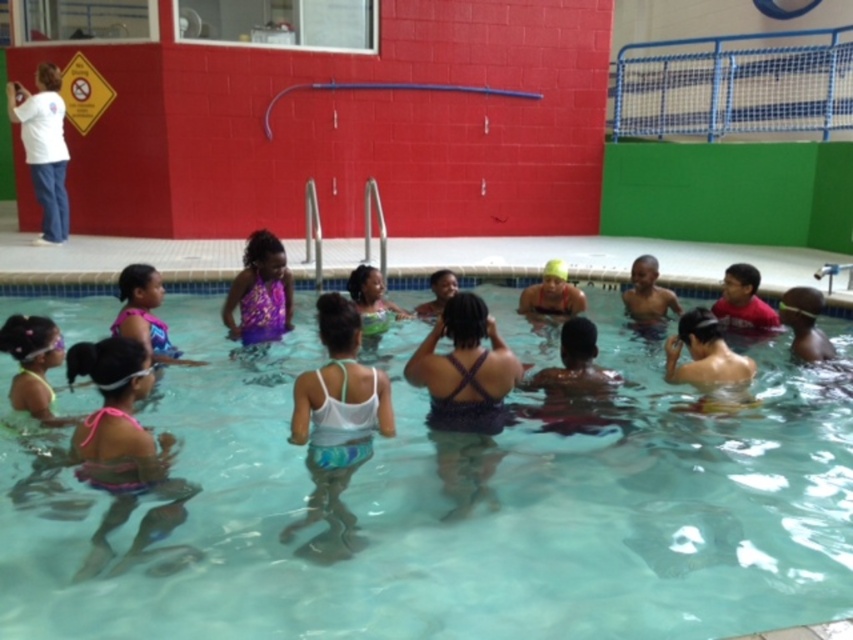
Which is in front, point (601, 412) or point (335, 294)?

Positioned in front is point (335, 294).

Consider the image. Between clear plastic water at center and white matte swimsuit at center, which one is positioned higher?

white matte swimsuit at center is higher up.

Does point (474, 564) come closer to viewer compared to point (323, 470)?

Yes.

At what (x,y) coordinates should I click in order to perform the action: click on clear plastic water at center. Please return your answer as a coordinate pair (x, y). This screenshot has width=853, height=640. Looking at the image, I should click on (454, 506).

Between point (381, 404) and point (91, 456), which one is positioned in front?

Point (91, 456) is in front.

I want to click on white matte swimsuit at center, so click(x=335, y=426).

Where is `white matte swimsuit at center`? This screenshot has width=853, height=640. white matte swimsuit at center is located at coordinates (335, 426).

Identify the location of white matte swimsuit at center. (335, 426).

Can you confirm if pink fabric swimsuit at lower left is positioned above white smooth shirt at upper left?

Incorrect, pink fabric swimsuit at lower left is not positioned above white smooth shirt at upper left.

Measure the distance between pink fabric swimsuit at lower left and camera.

pink fabric swimsuit at lower left and camera are 3.53 meters apart from each other.

I want to click on pink fabric swimsuit at lower left, so click(120, 445).

The width and height of the screenshot is (853, 640). What are the coordinates of `pink fabric swimsuit at lower left` in the screenshot? It's located at click(120, 445).